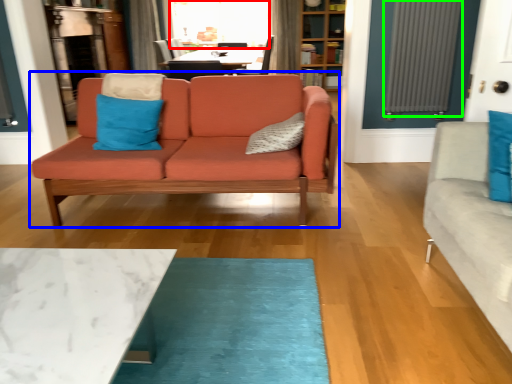
Question: Estimate the real-world distances between objects in this image. Which object is closer to window screen (highlighted by a red box), studio couch (highlighted by a blue box) or radiator (highlighted by a green box)?

Choices:
 (A) studio couch
 (B) radiator

Answer: (B)